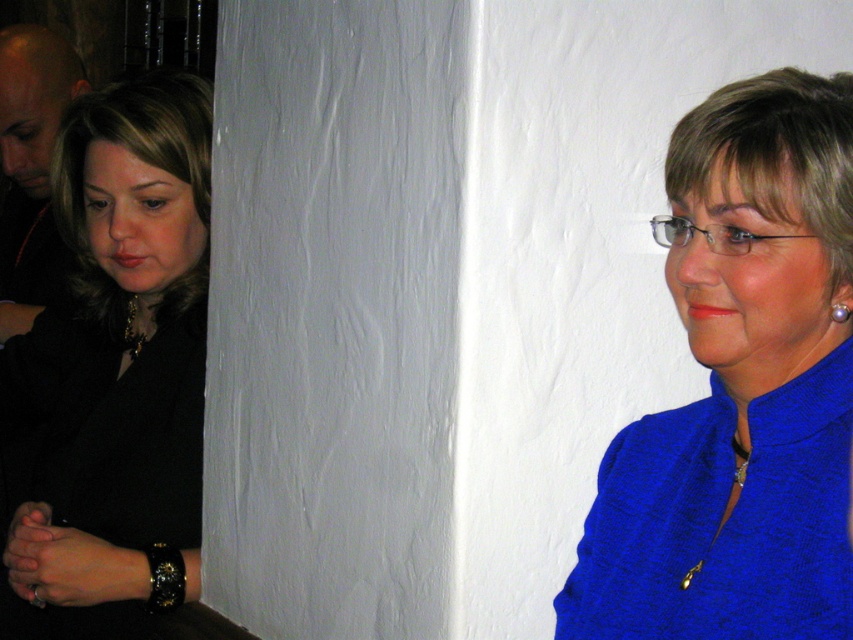
Question: Does blue fabric at upper right appear on the right side of black leather bracelet at lower left?

Choices:
 (A) yes
 (B) no

Answer: (A)

Question: Considering the real-world distances, which object is farthest from the black leather bracelet at lower left?

Choices:
 (A) blue fabric at upper right
 (B) black leather watch at lower left
 (C) black leather jacket at left
 (D) pearlelegantearring at upper right

Answer: (D)

Question: Based on their relative distances, which object is nearer to the pearlelegantearring at upper right?

Choices:
 (A) black leather watch at lower left
 (B) black leather bracelet at lower left

Answer: (B)

Question: Is blue fabric at upper right bigger than black leather bracelet at lower left?

Choices:
 (A) yes
 (B) no

Answer: (A)

Question: Does black leather watch at lower left come in front of pearlelegantearring at upper right?

Choices:
 (A) no
 (B) yes

Answer: (A)

Question: Which of the following is the closest to the observer?

Choices:
 (A) (180, 573)
 (B) (842, 307)
 (C) (96, 598)
 (D) (97, 284)

Answer: (B)